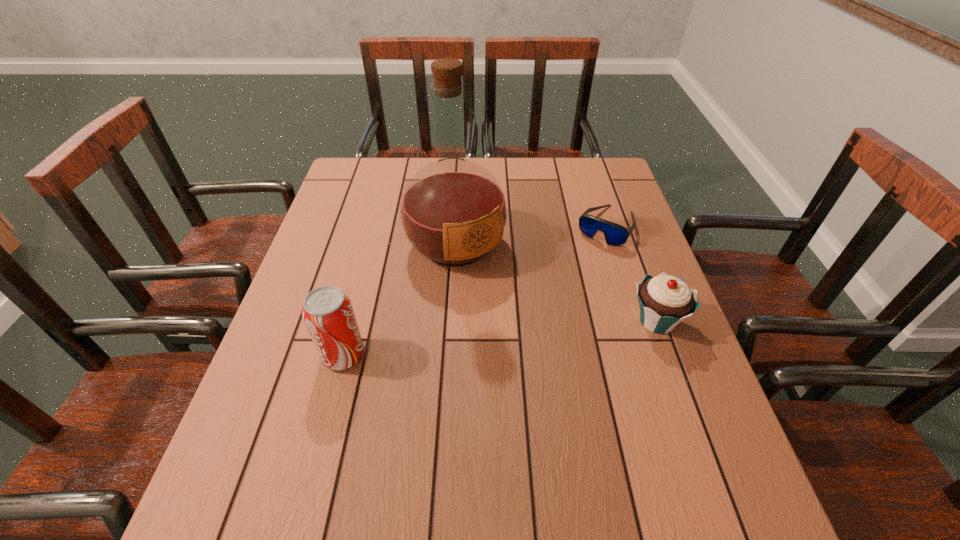
You are a GUI agent. You are given a task and a screenshot of the screen. Output one action in this format:
    pyautogui.click(x=<x>, y=<y>)
    Task: Click on the free space between the liquor and the sunglasses
    Image resolution: width=960 pixels, height=540 pixels.
    Given the screenshot: What is the action you would take?
    pyautogui.click(x=531, y=235)

Locate an element on the screen. This screenshot has height=540, width=960. blank region between the sunglasses and the leftmost object is located at coordinates point(475,291).

At what (x,y) coordinates should I click in order to perform the action: click on free space between the liquor and the shortest object. Please return your answer as a coordinate pair (x, y). The image size is (960, 540). Looking at the image, I should click on (531, 235).

Identify which object is the nearest to the sunglasses. Please provide its 2D coordinates. Your answer should be formatted as a tuple, i.e. [(x, y)], where the tuple contains the x and y coordinates of a point satisfying the conditions above.

[(665, 301)]

Select which object appears as the closest to the liquor. Please provide its 2D coordinates. Your answer should be formatted as a tuple, i.e. [(x, y)], where the tuple contains the x and y coordinates of a point satisfying the conditions above.

[(328, 314)]

Identify the location of vacant space that satisfies the following two spatial constraints: 1. on the front side of the second shortest object; 2. on the left side of the sunglasses. The height and width of the screenshot is (540, 960). (637, 321).